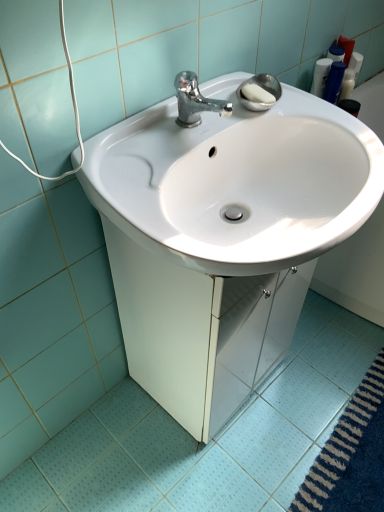
I want to click on vacant area that lies to the right of chrome metallic faucet at upper center, so click(264, 113).